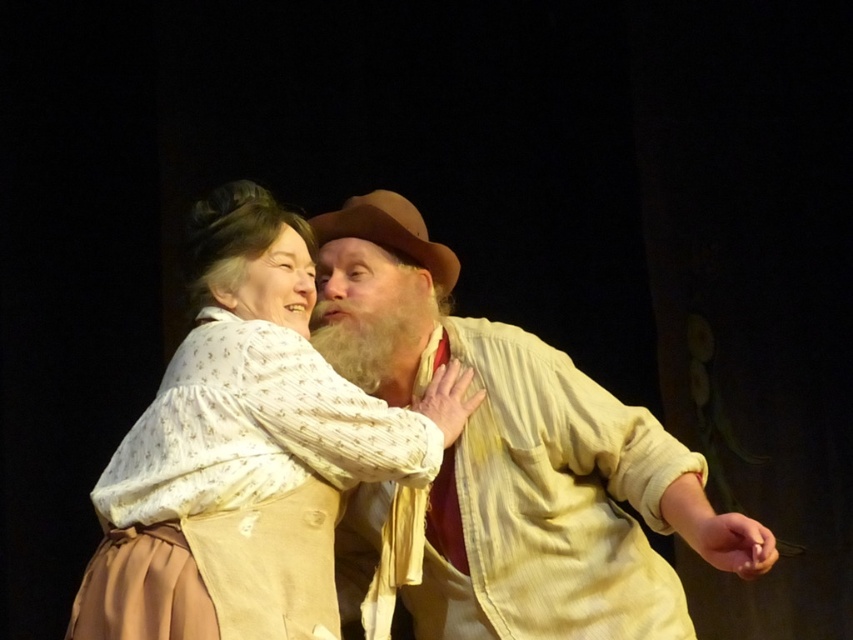
Does beige textured shirt at center have a larger size compared to brown felt cowboy hat at center?

Indeed, beige textured shirt at center has a larger size compared to brown felt cowboy hat at center.

Does beige textured shirt at center come in front of brown felt cowboy hat at center?

Yes, beige textured shirt at center is closer to the viewer.

Is point (467, 436) positioned after point (405, 227)?

No, it is in front of (405, 227).

I want to click on beige textured shirt at center, so click(517, 456).

Between point (633, 596) and point (201, 260), which one is positioned behind?

Point (633, 596)

Looking at this image, who is more forward, (x=554, y=349) or (x=274, y=321)?

Point (x=274, y=321) is more forward.

You are a GUI agent. You are given a task and a screenshot of the screen. Output one action in this format:
    pyautogui.click(x=<x>, y=<y>)
    Task: Click on the beige textured shirt at center
    Image resolution: width=853 pixels, height=640 pixels.
    Given the screenshot: What is the action you would take?
    pyautogui.click(x=517, y=456)

Does matte white blouse at center have a lesser height compared to brown felt cowboy hat at center?

Incorrect, matte white blouse at center's height does not fall short of brown felt cowboy hat at center's.

Measure the distance between point (212,244) and camera.

Point (212,244) is 2.74 meters from camera.

Does point (302, 468) come closer to viewer compared to point (352, 204)?

Yes.

This screenshot has width=853, height=640. What are the coordinates of `matte white blouse at center` in the screenshot? It's located at (247, 451).